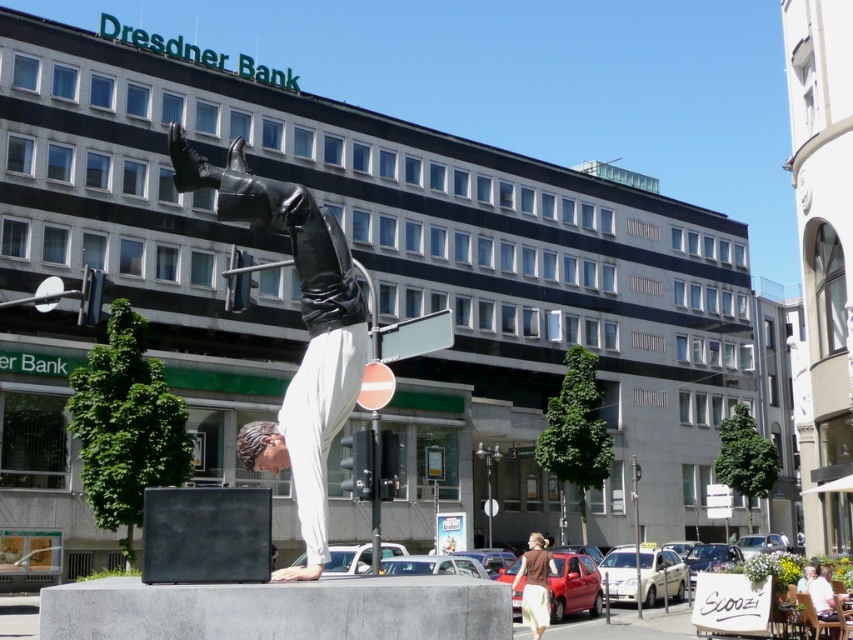
Does polished bronze statue at center have a larger size compared to brown cotton shirt at lower center?

Incorrect, polished bronze statue at center is not larger than brown cotton shirt at lower center.

Who is lower down, polished bronze statue at center or brown cotton shirt at lower center?

brown cotton shirt at lower center is lower down.

Is point (310, 528) positioned behind point (532, 625)?

No, (310, 528) is closer to viewer.

What are the coordinates of `polished bronze statue at center` in the screenshot? It's located at (306, 326).